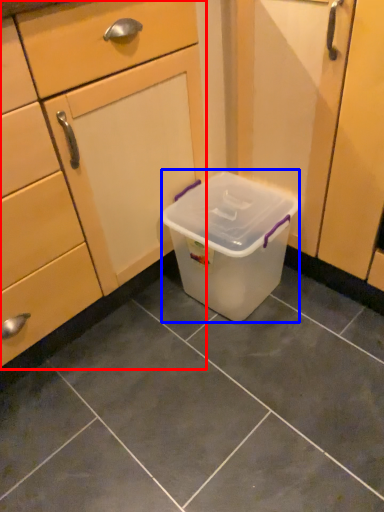
Question: Which object is further to the camera taking this photo, cabinetry (highlighted by a red box) or storage box (highlighted by a blue box)?

Choices:
 (A) cabinetry
 (B) storage box

Answer: (B)